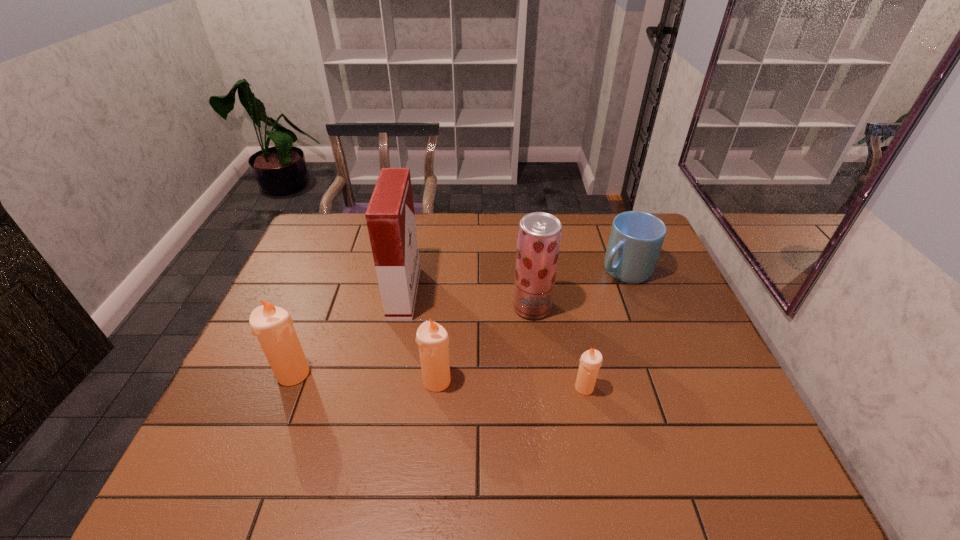
Please point a vacant point for placing a candle on the right. Please provide its 2D coordinates. Your answer should be formatted as a tuple, i.e. [(x, y)], where the tuple contains the x and y coordinates of a point satisfying the conditions above.

[(736, 395)]